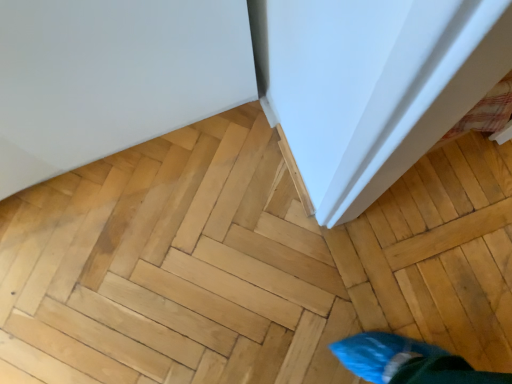
Measure the distance between light brown wood plank at lower right and camera.

light brown wood plank at lower right is 3.76 feet away from camera.

The height and width of the screenshot is (384, 512). What do you see at coordinates (449, 235) in the screenshot?
I see `light brown wood plank at lower right` at bounding box center [449, 235].

At what (x,y) coordinates should I click in order to perform the action: click on light brown wood plank at lower right. Please return your answer as a coordinate pair (x, y). This screenshot has height=384, width=512. Looking at the image, I should click on click(449, 235).

The width and height of the screenshot is (512, 384). What are the coordinates of `light brown wood plank at lower right` in the screenshot? It's located at (449, 235).